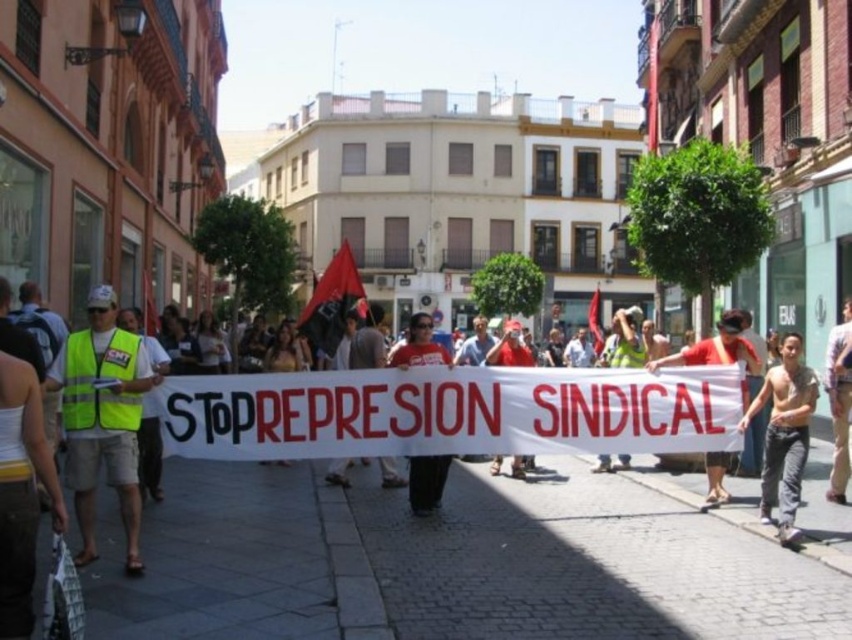
Is point (89, 416) positioned before point (84, 396)?

Yes, point (89, 416) is in front of point (84, 396).

Does point (90, 468) come closer to viewer compared to point (114, 333)?

Yes, point (90, 468) is closer to viewer.

I want to click on yellow reflective vest at left, so tap(102, 419).

Can you confirm if shiny black shirt at center is positioned above high-visibility yellow safety vest at left?

Actually, shiny black shirt at center is below high-visibility yellow safety vest at left.

This screenshot has height=640, width=852. In order to click on shiny black shirt at center in this screenshot , I will do coord(784,435).

Where is `shiny black shirt at center`? shiny black shirt at center is located at coordinates (784, 435).

Is yellow reflective vest at left below shiny black shirt at center?

Indeed, yellow reflective vest at left is positioned under shiny black shirt at center.

This screenshot has height=640, width=852. Describe the element at coordinates (102, 419) in the screenshot. I see `yellow reflective vest at left` at that location.

In order to click on yellow reflective vest at left in this screenshot , I will do `click(102, 419)`.

At what (x,y) coordinates should I click in order to perform the action: click on yellow reflective vest at left. Please return your answer as a coordinate pair (x, y). The height and width of the screenshot is (640, 852). Looking at the image, I should click on (102, 419).